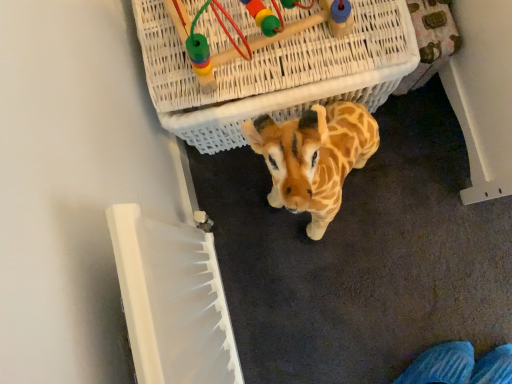
The height and width of the screenshot is (384, 512). What are the coordinates of `white wicker basket at upper center` in the screenshot? It's located at (269, 56).

This screenshot has height=384, width=512. Describe the element at coordinates (269, 56) in the screenshot. I see `white wicker basket at upper center` at that location.

The height and width of the screenshot is (384, 512). Identify the location of white wicker basket at upper center. (269, 56).